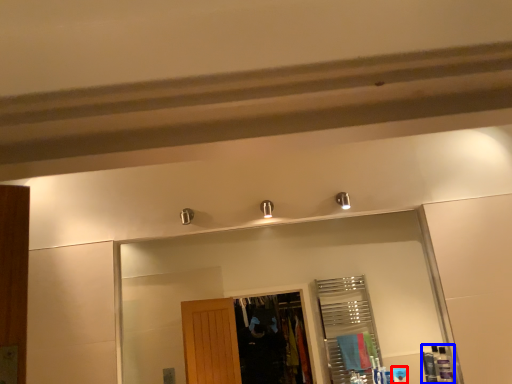
Question: Which object appears farthest to the camera in this image, toiletry (highlighted by a red box) or toiletry (highlighted by a blue box)?

Choices:
 (A) toiletry
 (B) toiletry

Answer: (A)